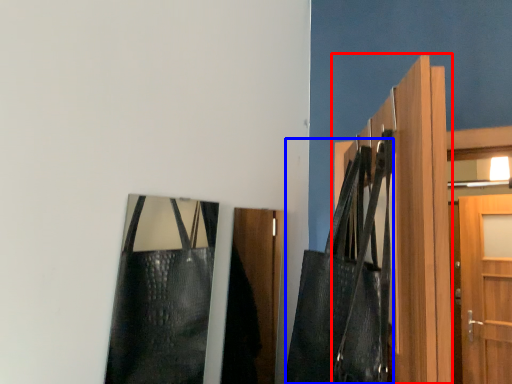
Question: Which object appears farthest to the camera in this image, door (highlighted by a red box) or shoulder bag (highlighted by a blue box)?

Choices:
 (A) door
 (B) shoulder bag

Answer: (B)